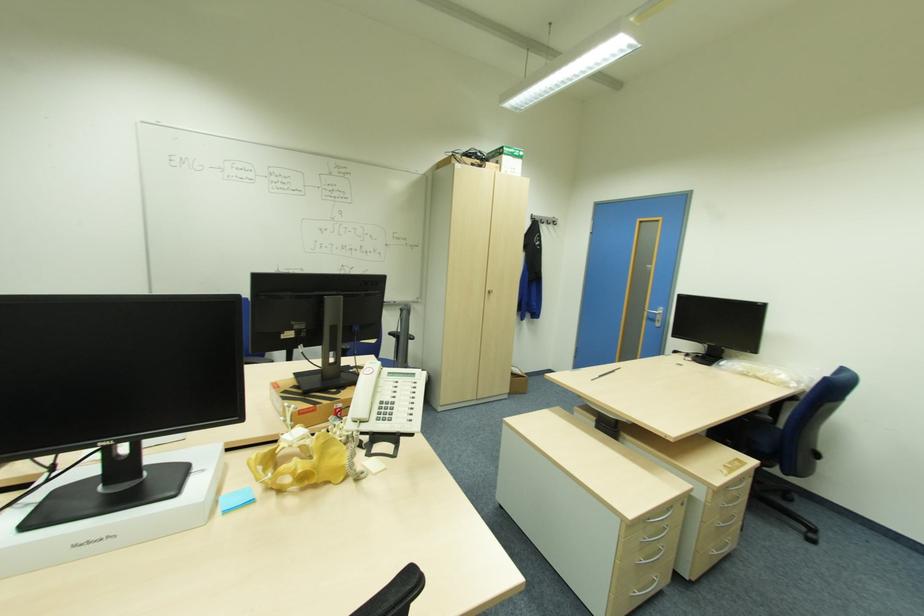
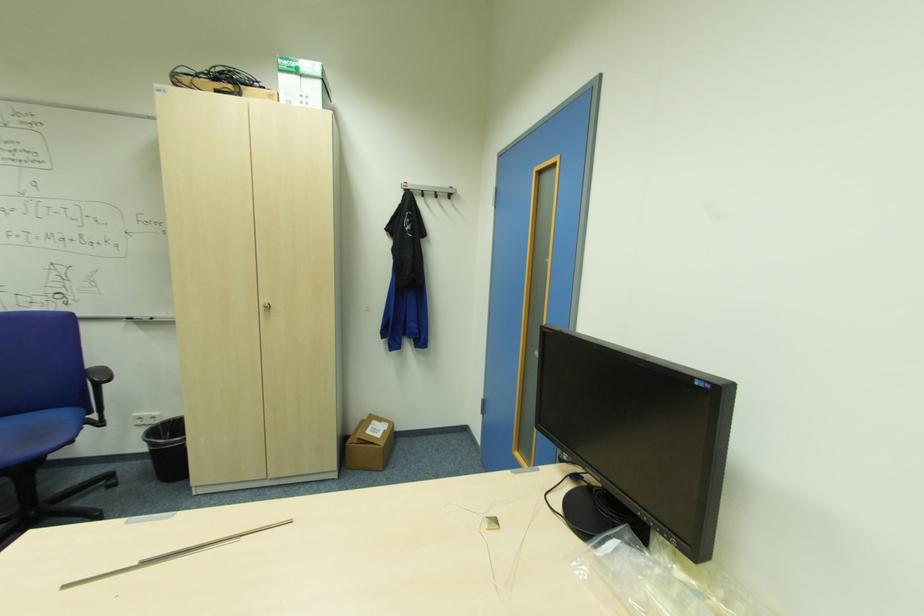
Where in the second image is the point corresponding to pixel 507 152 from the first image?

(287, 69)